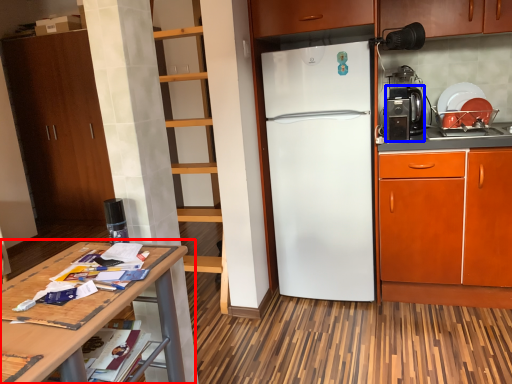
Question: Which of the following is the farthest to the observer, table (highlighted by a red box) or coffee machine (highlighted by a blue box)?

Choices:
 (A) table
 (B) coffee machine

Answer: (B)